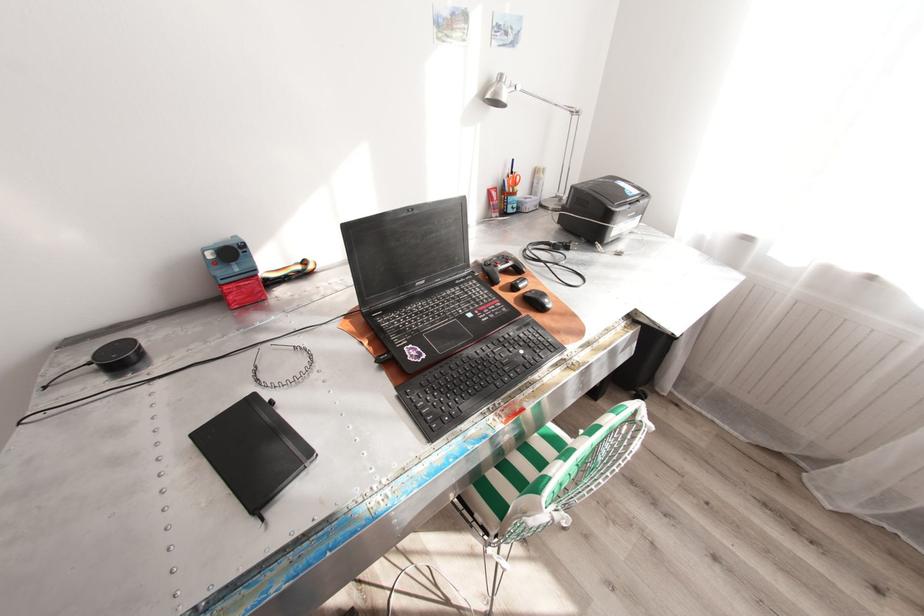
Locate an element on the screen. The width and height of the screenshot is (924, 616). red scissors handle is located at coordinates (512, 180).